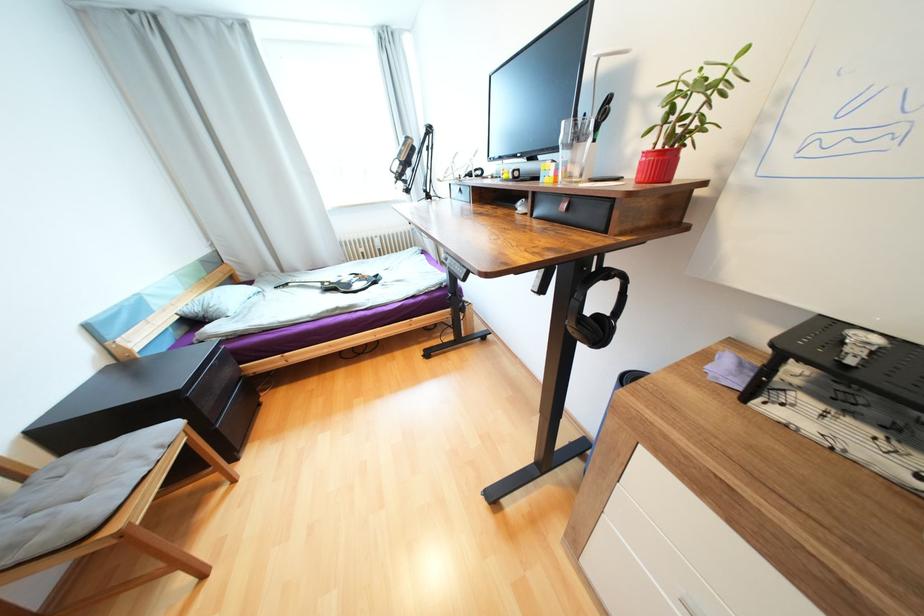
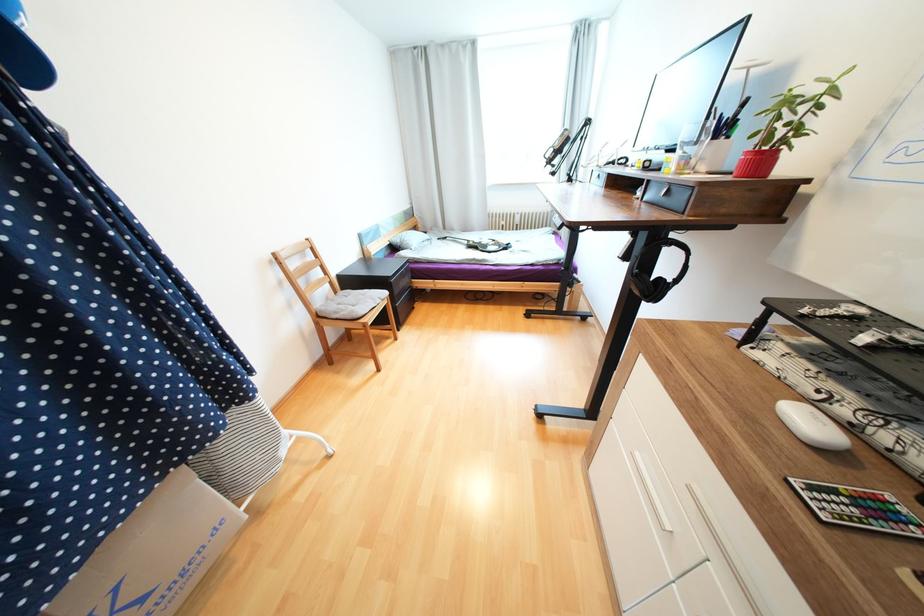
In the second image, find the point that corresponds to (x=147, y=458) in the first image.

(379, 300)